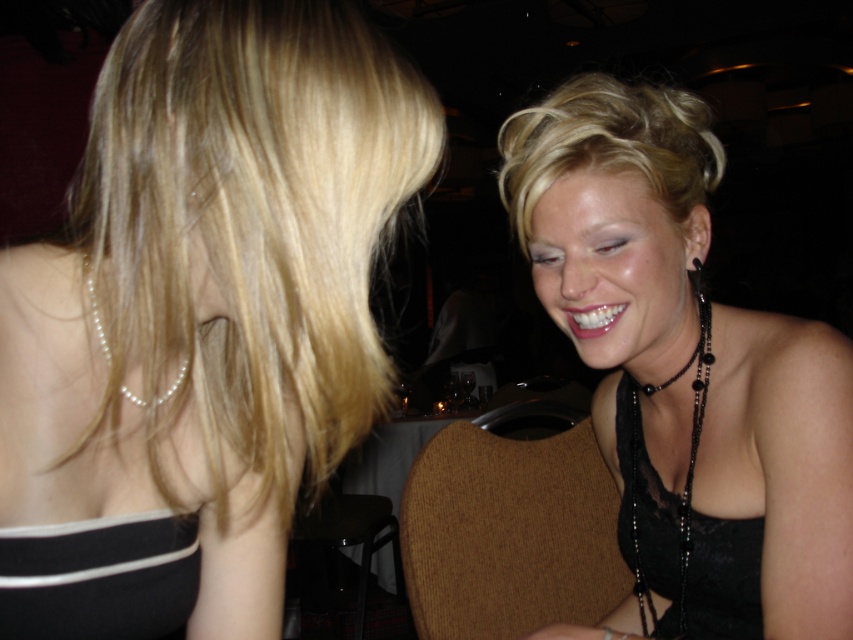
You are a photographer at a social event and need to capture a closeup shot of both the blonde smooth hair at upper left and the black lace dress at upper right. The camera you are using has a maximum focus range of 12 inches. Can you fit both subjects within the camera focus range?

The blonde smooth hair at upper left is 13.22 inches away from the black lace dress at upper right, which exceeds the camera focus range of 12 inches. Therefore, you cannot fit both subjects within the camera focus range.